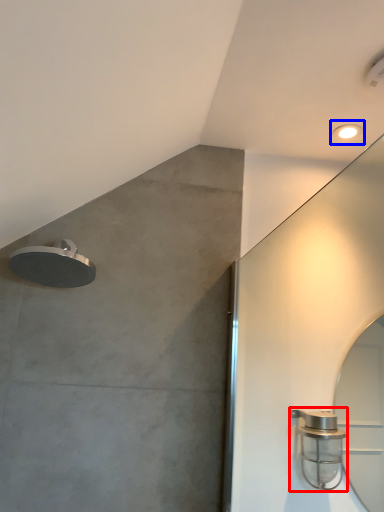
Question: Which object is closer to the camera taking this photo, shower (highlighted by a red box) or droplight (highlighted by a blue box)?

Choices:
 (A) shower
 (B) droplight

Answer: (A)